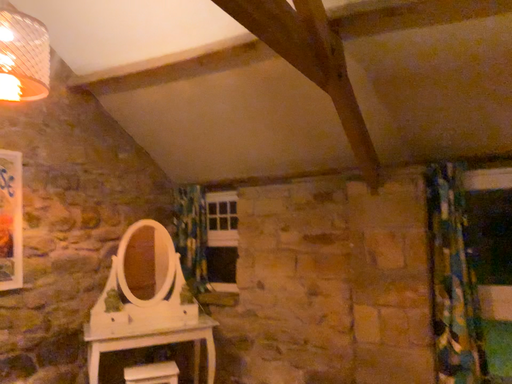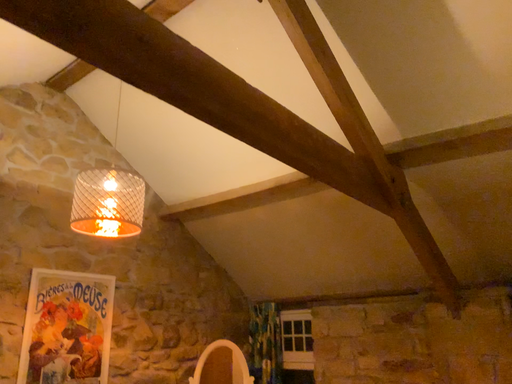
Question: Which way did the camera rotate in the video?

Choices:
 (A) rotated upward
 (B) rotated downward

Answer: (A)